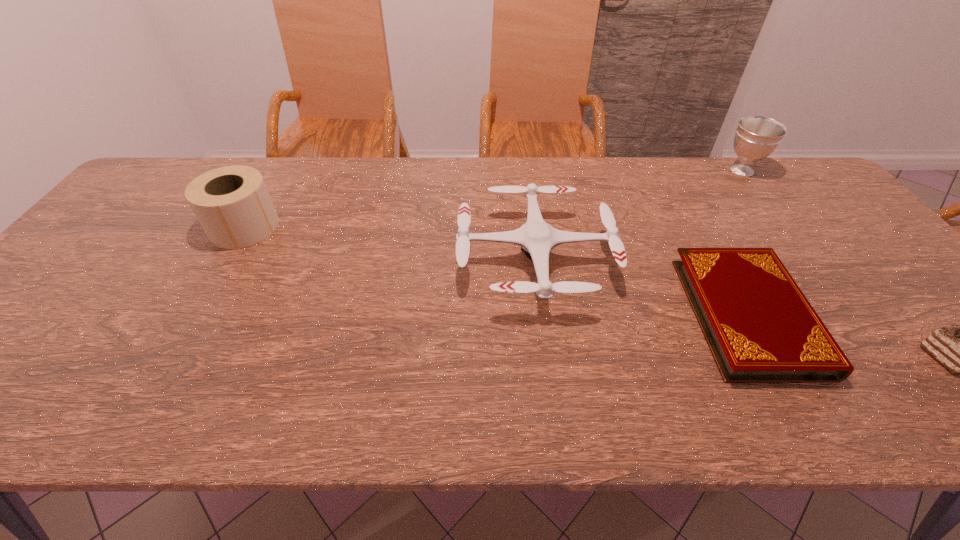
Locate an element on the screen. free space between the third object from left to right and the leftmost object is located at coordinates (496, 271).

Image resolution: width=960 pixels, height=540 pixels. I want to click on vacant area that lies between the third object from left to right and the chalice, so click(x=744, y=243).

The height and width of the screenshot is (540, 960). I want to click on free space between the toilet tissue and the hardback book, so click(496, 271).

Identify the location of vacant space that is in between the hardback book and the farthest object. click(744, 243).

Image resolution: width=960 pixels, height=540 pixels. In order to click on free space between the drone and the leftmost object in this screenshot , I will do `click(390, 244)`.

Identify the location of free space between the drone and the shortest object. (641, 287).

Locate an element on the screen. object that stands as the fourth closest to the third shortest object is located at coordinates (959, 347).

Point out which object is positioned as the nearest to the farthest object. Please provide its 2D coordinates. Your answer should be formatted as a tuple, i.e. [(x, y)], where the tuple contains the x and y coordinates of a point satisfying the conditions above.

[(760, 328)]